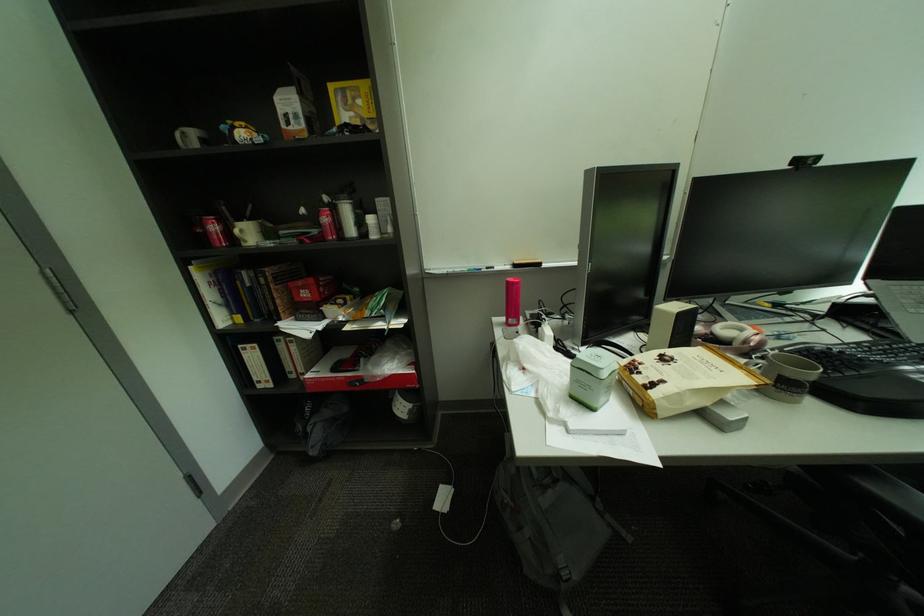
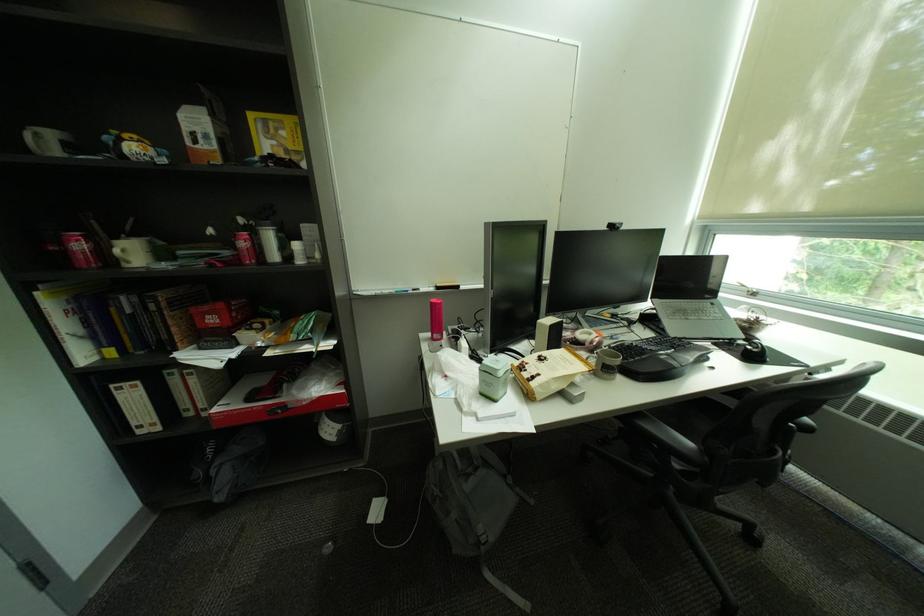
Question: The images are taken continuously from a first-person perspective. In which direction are you moving?

Choices:
 (A) Left
 (B) Right
 (C) Forward
 (D) Backward

Answer: (D)